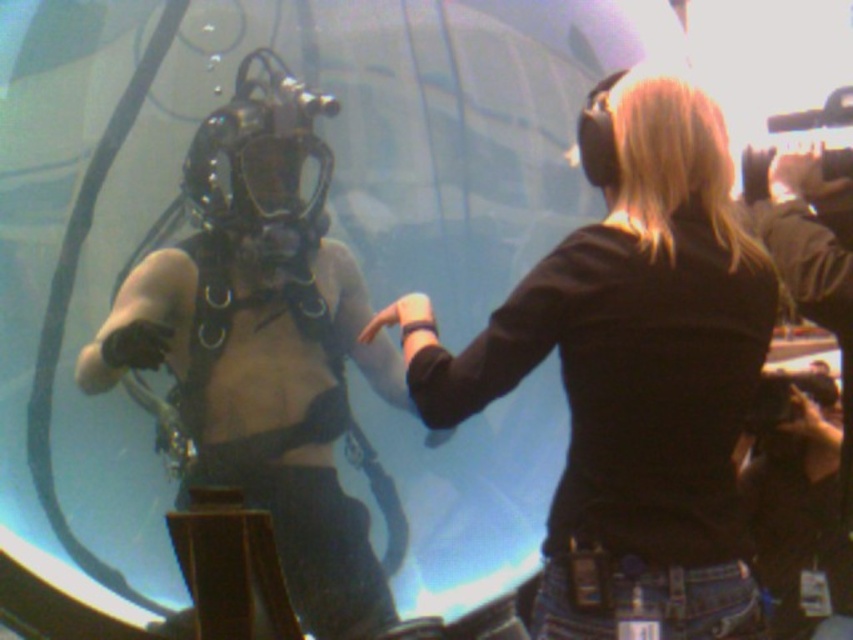
Who is more forward, (x=595, y=490) or (x=236, y=477)?

Point (x=236, y=477)

Which is below, black matte shirt at upper right or metallic scuba gear at center?

metallic scuba gear at center is lower down.

Describe the element at coordinates (631, 372) in the screenshot. I see `black matte shirt at upper right` at that location.

At what (x,y) coordinates should I click in order to perform the action: click on black matte shirt at upper right. Please return your answer as a coordinate pair (x, y). This screenshot has width=853, height=640. Looking at the image, I should click on (631, 372).